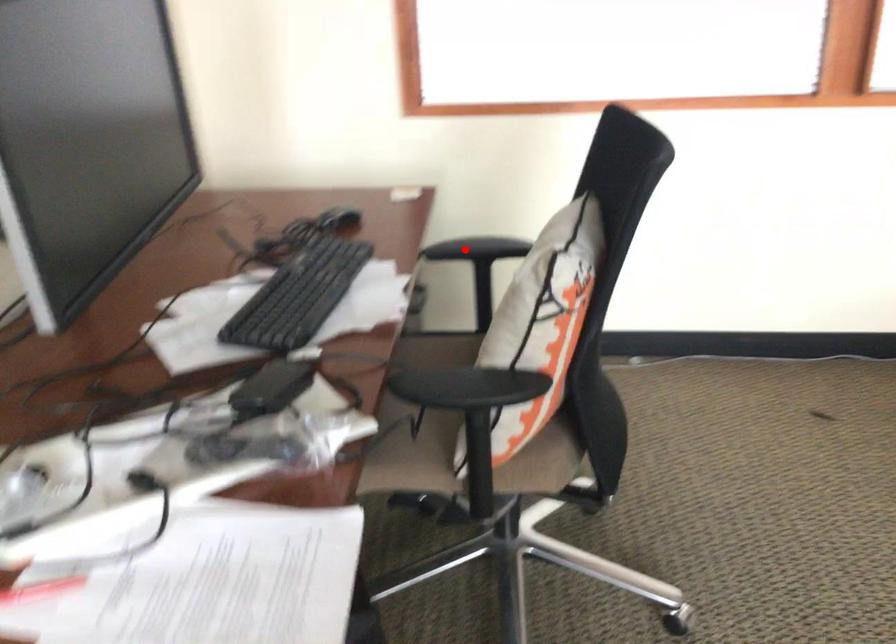
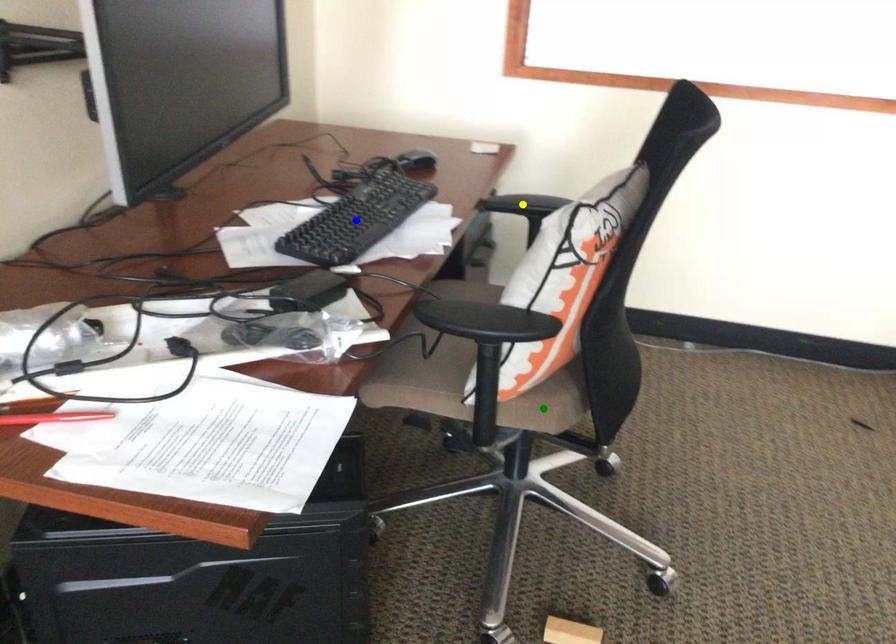
Question: I am providing you with two images of the same scene from different viewpoints. A red point is marked on the first image. You are given multiple points on the second image. In image 2, which mark is for the same physical point as the one in image 1?

Choices:
 (A) blue point
 (B) green point
 (C) yellow point

Answer: (C)